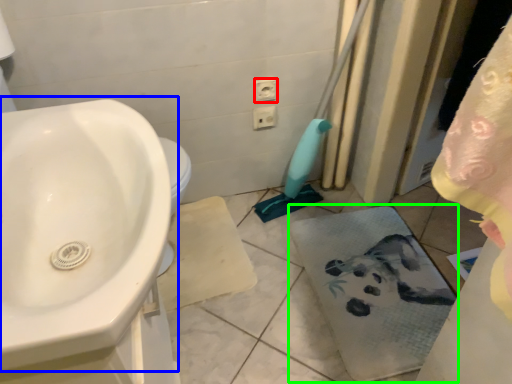
Question: Which object is positioned farthest from electric outlet (highlighted by a red box)? Select from sink (highlighted by a blue box) and bath towel (highlighted by a green box).

Choices:
 (A) sink
 (B) bath towel

Answer: (A)